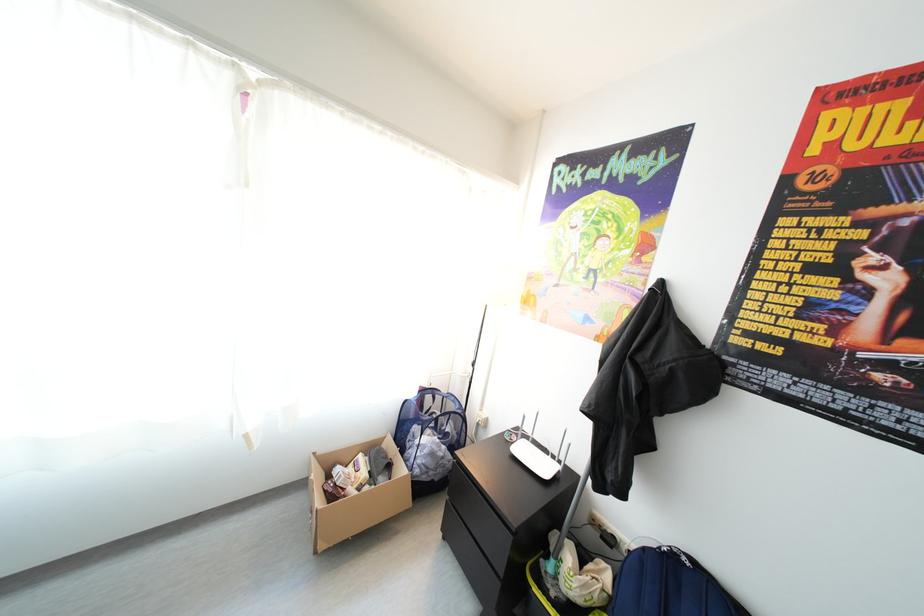
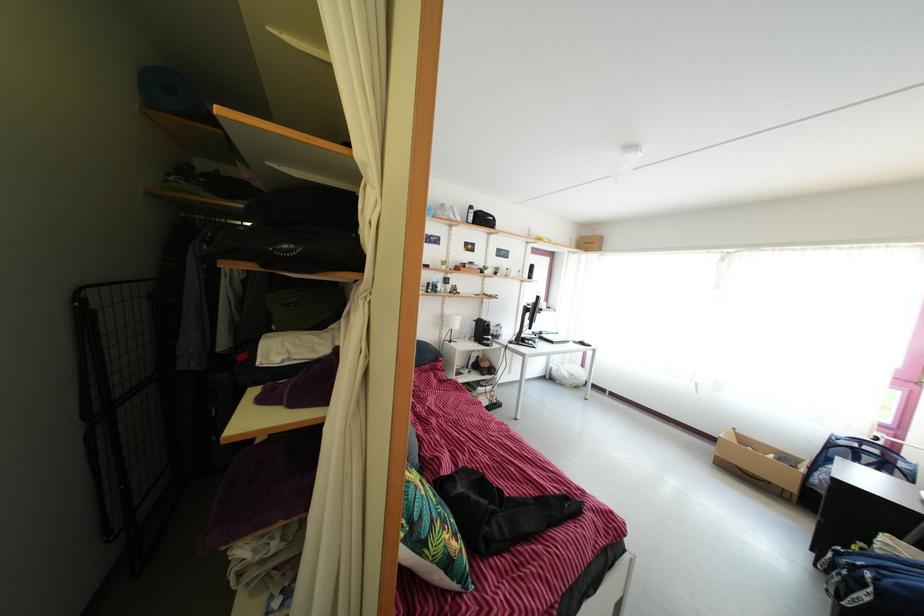
Locate, in the second image, the point that corresponds to point (423, 480) in the first image.

(821, 488)